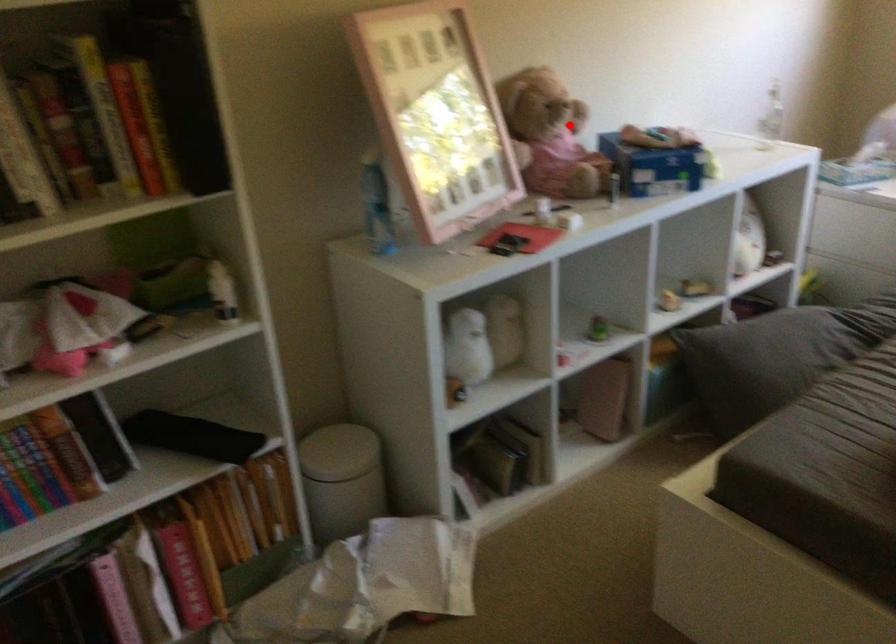
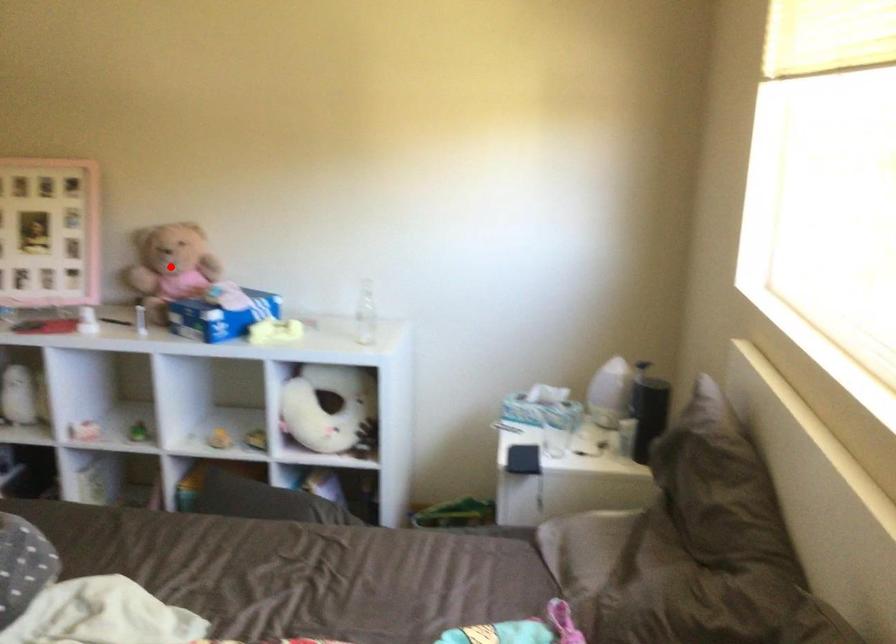
I am providing you with two images of the same scene from different viewpoints. A red point is marked on the first image and another point is marked on the second image. Are the points marked in image1 and image2 representing the same 3D position?

Yes